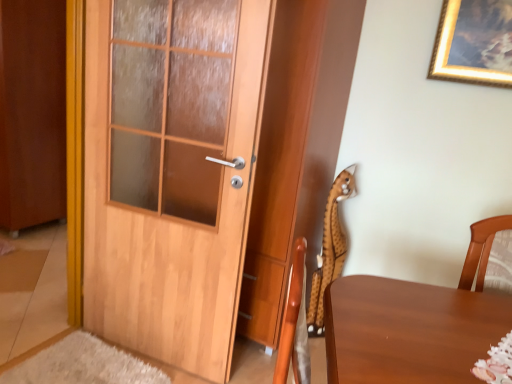
Question: Relative to wooden door at left, is spotted plush toy at right in front or behind?

Choices:
 (A) front
 (B) behind

Answer: (B)

Question: From the image's perspective, relative to wooden door at left, is spotted plush toy at right above or below?

Choices:
 (A) above
 (B) below

Answer: (B)

Question: Which of these objects is positioned closest to the wooden door at left?

Choices:
 (A) spotted plush toy at right
 (B) brown wooden door at left

Answer: (A)

Question: Which object is the closest to the brown wooden door at left?

Choices:
 (A) wooden door at left
 (B) spotted plush toy at right

Answer: (A)